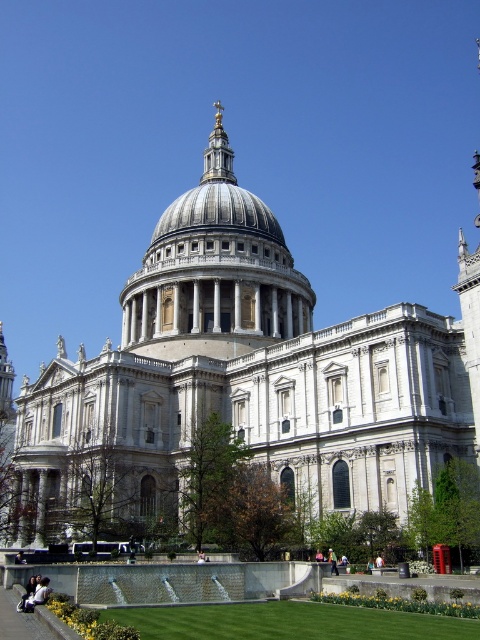
Is white stone cathedral at center positioned behind silver metallic dome at center?

No, white stone cathedral at center is in front of silver metallic dome at center.

Image resolution: width=480 pixels, height=640 pixels. Find the location of `white stone cathedral at center`. white stone cathedral at center is located at coordinates (243, 378).

Locate an element on the screen. The height and width of the screenshot is (640, 480). white stone cathedral at center is located at coordinates (243, 378).

Where is `white stone cathedral at center`? white stone cathedral at center is located at coordinates (243, 378).

Is the position of white stone cathedral at center less distant than that of silver/grey stone dome at center?

Yes.

Which is above, white stone cathedral at center or silver/grey stone dome at center?

silver/grey stone dome at center is higher up.

Measure the distance between point (28,461) and camera.

→ Point (28,461) is 66.27 meters from camera.

At what (x,y) coordinates should I click in order to perform the action: click on white stone cathedral at center. Please return your answer as a coordinate pair (x, y). Looking at the image, I should click on (243, 378).

Is silver/grey stone dome at center in front of silver metallic dome at center?

Yes, silver/grey stone dome at center is closer to the viewer.

Locate an element on the screen. silver/grey stone dome at center is located at coordinates (215, 272).